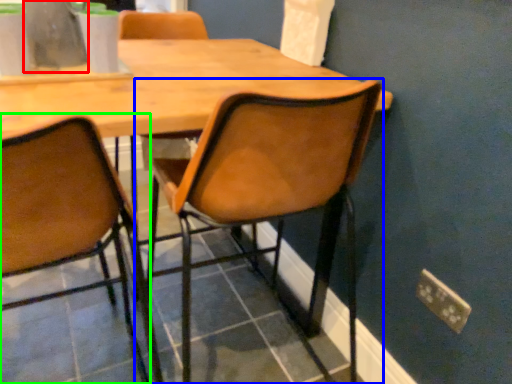
Question: Considering the real-world distances, which object is farthest from vase (highlighted by a red box)? chair (highlighted by a blue box) or chair (highlighted by a green box)?

Choices:
 (A) chair
 (B) chair

Answer: (A)